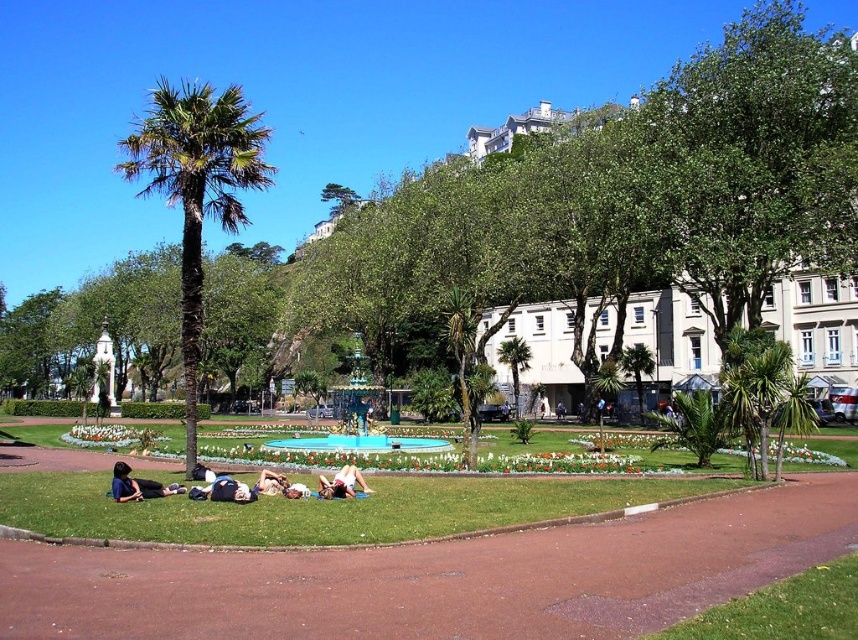
Looking at this image, between green leafy palm tree at center and light brown fabric person at center, which one appears on the left side from the viewer's perspective?

Positioned to the left is light brown fabric person at center.

Is point (515, 372) behind point (275, 477)?

Yes.

The width and height of the screenshot is (858, 640). Find the location of `green leafy palm tree at center`. green leafy palm tree at center is located at coordinates (514, 364).

Can you confirm if white cotton shirt at center is smaller than white fabric person at center?

Correct, white cotton shirt at center occupies less space than white fabric person at center.

Between white cotton shirt at center and white fabric person at center, which one is positioned lower?

white fabric person at center

Between point (240, 488) and point (353, 484), which one is positioned behind?

The point (353, 484) is more distant.

At what (x,y) coordinates should I click in order to perform the action: click on white cotton shirt at center. Please return your answer as a coordinate pair (x, y). This screenshot has width=858, height=640. Looking at the image, I should click on (222, 490).

Consider the image. Between blue glass pool at center and green leafy palm tree at center, which one has less height?

blue glass pool at center is shorter.

Does point (310, 442) lie behind point (498, 358)?

No, it is not.

The image size is (858, 640). I want to click on blue glass pool at center, so click(358, 444).